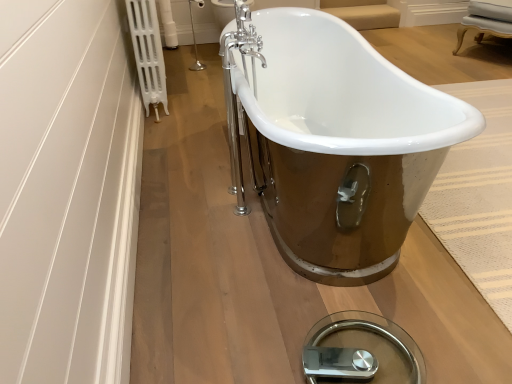
Question: Does white plastic radiator at upper left appear on the right side of white porcelain bathtub at center?

Choices:
 (A) yes
 (B) no

Answer: (B)

Question: From the image's perspective, is white plastic radiator at upper left on top of white porcelain bathtub at center?

Choices:
 (A) yes
 (B) no

Answer: (A)

Question: Does white plastic radiator at upper left have a smaller size compared to white porcelain bathtub at center?

Choices:
 (A) yes
 (B) no

Answer: (A)

Question: Is white plastic radiator at upper left at the left side of white porcelain bathtub at center?

Choices:
 (A) yes
 (B) no

Answer: (A)

Question: Is white plastic radiator at upper left taller than white porcelain bathtub at center?

Choices:
 (A) no
 (B) yes

Answer: (B)

Question: Considering the relative positions of white plastic radiator at upper left and white porcelain bathtub at center in the image provided, is white plastic radiator at upper left to the left or to the right of white porcelain bathtub at center?

Choices:
 (A) left
 (B) right

Answer: (A)

Question: From the image's perspective, is white plastic radiator at upper left above or below white porcelain bathtub at center?

Choices:
 (A) above
 (B) below

Answer: (A)

Question: Is point (153, 105) positioned closer to the camera than point (373, 94)?

Choices:
 (A) closer
 (B) farther

Answer: (B)

Question: In terms of size, does white plastic radiator at upper left appear bigger or smaller than white porcelain bathtub at center?

Choices:
 (A) big
 (B) small

Answer: (B)

Question: From their relative heights in the image, would you say white plastic radiator at upper left is taller or shorter than chrome metallic faucet at upper center?

Choices:
 (A) tall
 (B) short

Answer: (A)

Question: Looking at their shapes, would you say white plastic radiator at upper left is wider or thinner than chrome metallic faucet at upper center?

Choices:
 (A) thin
 (B) wide

Answer: (A)

Question: From the image's perspective, is white plastic radiator at upper left located above or below chrome metallic faucet at upper center?

Choices:
 (A) above
 (B) below

Answer: (B)

Question: In the image, is white plastic radiator at upper left on the left side or the right side of chrome metallic faucet at upper center?

Choices:
 (A) left
 (B) right

Answer: (A)

Question: Looking at the image, does chrome metallic faucet at upper center seem bigger or smaller compared to white plastic radiator at upper left?

Choices:
 (A) big
 (B) small

Answer: (B)

Question: Which is correct: chrome metallic faucet at upper center is inside white plastic radiator at upper left, or outside of it?

Choices:
 (A) inside
 (B) outside

Answer: (B)